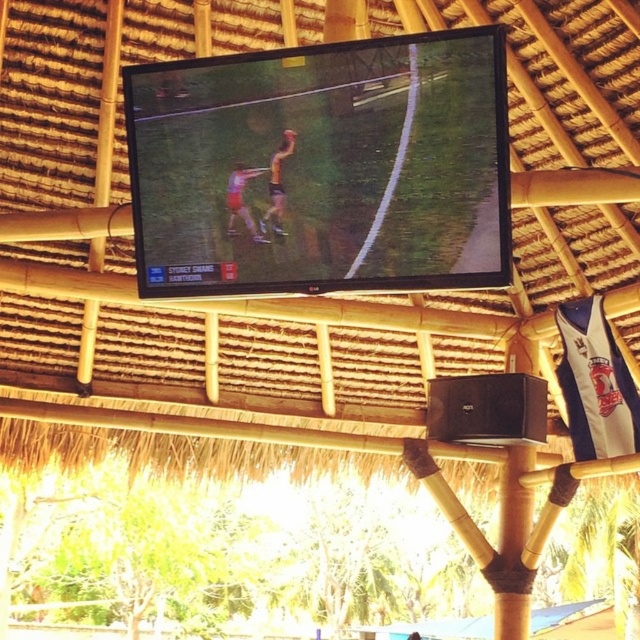
Can you confirm if flat-screen tv at center is positioned to the left of yellow-orange jersey at center?

No, flat-screen tv at center is not to the left of yellow-orange jersey at center.

Can you confirm if flat-screen tv at center is shorter than yellow-orange jersey at center?

Incorrect, flat-screen tv at center's height does not fall short of yellow-orange jersey at center's.

Does point (138, 104) come farther from viewer compared to point (278, 212)?

Yes, point (138, 104) is farther from viewer.

In order to click on flat-screen tv at center in this screenshot , I will do `click(324, 166)`.

Is point (225, 99) farther from viewer compared to point (234, 205)?

No, (225, 99) is in front of (234, 205).

Can you confirm if flat-screen tv at center is positioned to the left of matte pink shorts at center?

No, flat-screen tv at center is not to the left of matte pink shorts at center.

This screenshot has height=640, width=640. Find the location of `flat-screen tv at center`. flat-screen tv at center is located at coordinates (324, 166).

Find the location of a particular element. The width and height of the screenshot is (640, 640). flat-screen tv at center is located at coordinates (324, 166).

Can you confirm if yellow-orange jersey at center is taller than matte pink shorts at center?

Indeed, yellow-orange jersey at center has a greater height compared to matte pink shorts at center.

Describe the element at coordinates (276, 186) in the screenshot. This screenshot has width=640, height=640. I see `yellow-orange jersey at center` at that location.

Find the location of a particular element. This screenshot has width=640, height=640. yellow-orange jersey at center is located at coordinates click(276, 186).